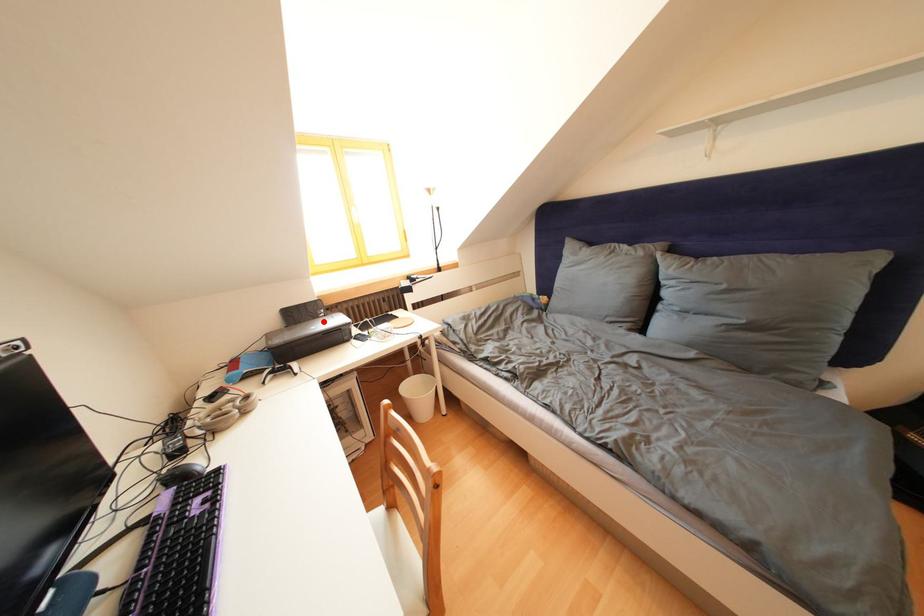
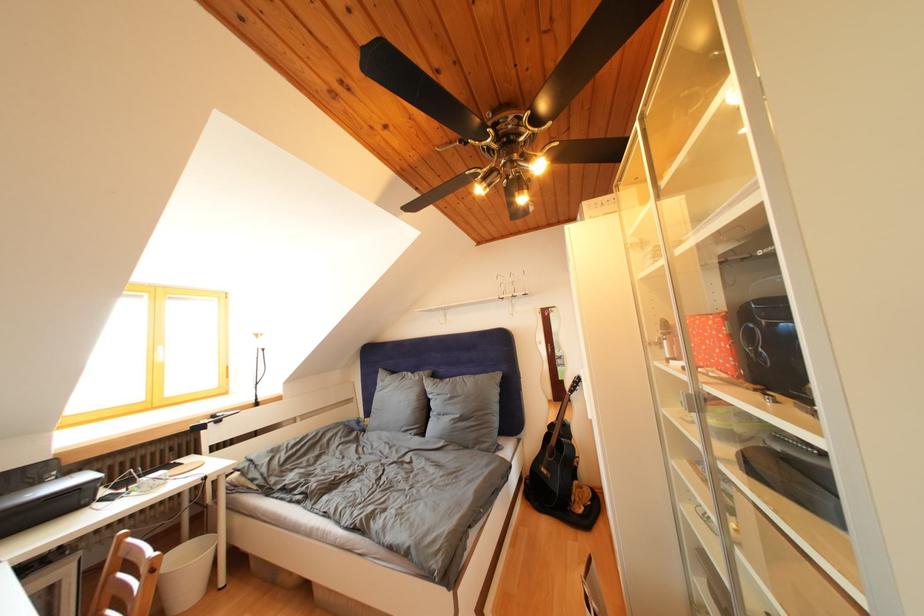
Find the pixel in the second image that matches the highlighted location in the first image.

(44, 488)